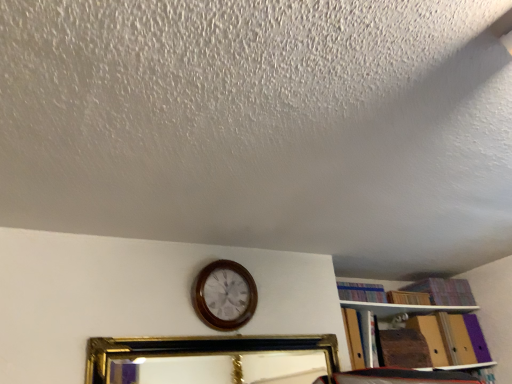
Question: Is striped fabric book at upper right in front of or behind wooden wall clock at center in the image?

Choices:
 (A) front
 (B) behind

Answer: (B)

Question: Is striped fabric book at upper right wider or thinner than wooden wall clock at center?

Choices:
 (A) thin
 (B) wide

Answer: (B)

Question: Based on their relative distances, which object is farther from the striped fabric book at upper right?

Choices:
 (A) gold/gilded picture frame at center
 (B) wooden wall clock at center

Answer: (A)

Question: Which of these objects is positioned farthest from the wooden wall clock at center?

Choices:
 (A) gold/gilded picture frame at center
 (B) striped fabric book at upper right

Answer: (A)